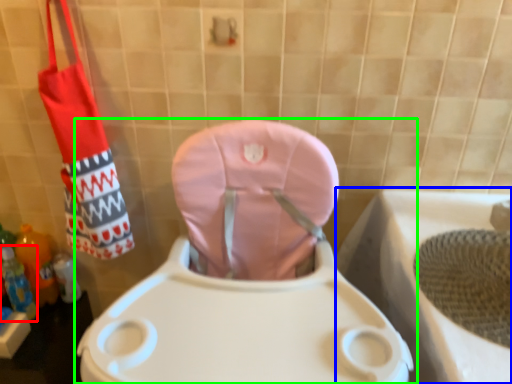
Question: Which object is positioned closest to bottle (highlighted by a red box)? Select from bath (highlighted by a blue box) and toilet (highlighted by a green box).

Choices:
 (A) bath
 (B) toilet

Answer: (B)